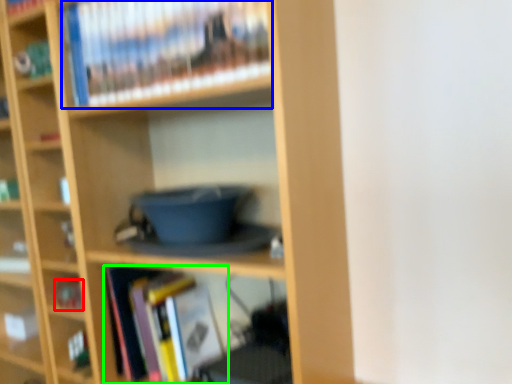
Question: Considering the real-world distances, which object is closest to book (highlighted by a red box)? book (highlighted by a blue box) or book (highlighted by a green box).

Choices:
 (A) book
 (B) book

Answer: (B)